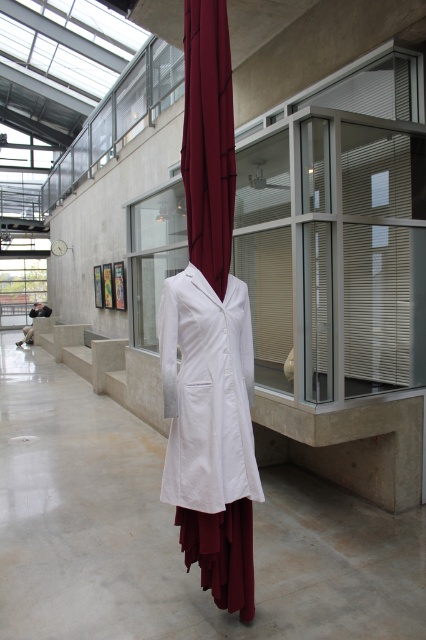
From the picture: Which is more to the left, white smooth coat at center or burgundy fabric curtain at center?

burgundy fabric curtain at center

The width and height of the screenshot is (426, 640). In order to click on white smooth coat at center in this screenshot , I will do `click(210, 429)`.